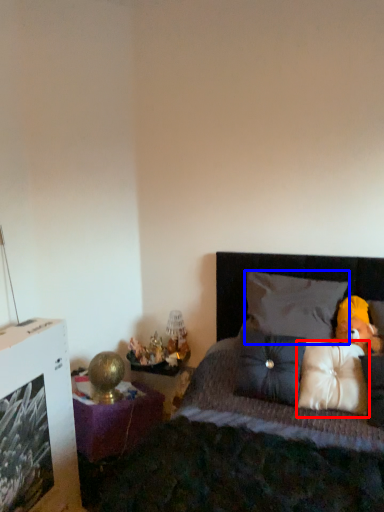
Question: Which of the following is the closest to the observer, pillow (highlighted by a red box) or pillow (highlighted by a blue box)?

Choices:
 (A) pillow
 (B) pillow

Answer: (A)